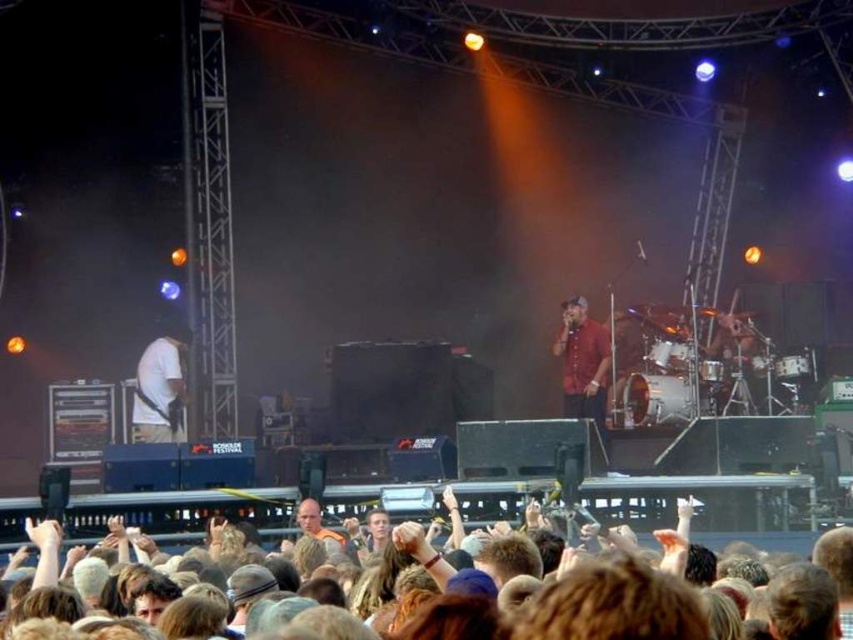
Question: Can you confirm if brown hair at lower center is positioned above white matte guitar at left?

Choices:
 (A) no
 (B) yes

Answer: (A)

Question: Is brown hair at lower center wider than red matte shirt at center?

Choices:
 (A) yes
 (B) no

Answer: (A)

Question: Which point appears farthest from the camera in this image?

Choices:
 (A) (598, 326)
 (B) (508, 506)
 (C) (146, 420)

Answer: (A)

Question: Which point is closer to the camera taking this photo?

Choices:
 (A) (575, 340)
 (B) (485, 488)

Answer: (B)

Question: Is brown hair at lower center further to camera compared to white matte guitar at left?

Choices:
 (A) no
 (B) yes

Answer: (A)

Question: Which of the following is the closest to the observer?

Choices:
 (A) white matte guitar at left
 (B) brown hair at lower center

Answer: (B)